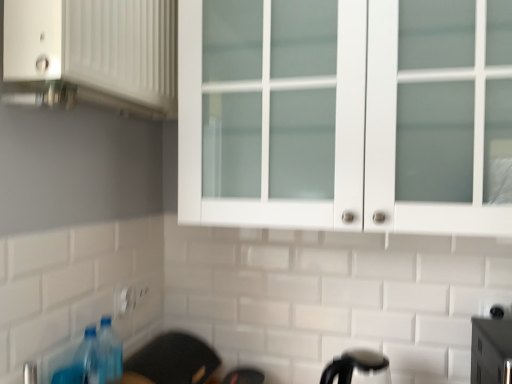
I want to click on white matte cabinet at upper left, so click(x=92, y=54).

This screenshot has height=384, width=512. Identify the location of white glass cabinet at upper center. (346, 114).

What do you see at coordinates (358, 368) in the screenshot?
I see `black plastic kettle at lower center` at bounding box center [358, 368].

Where is `white plastic electric outlet at lower center`? white plastic electric outlet at lower center is located at coordinates (124, 300).

Can you confirm if blue plastic bottle at lower left is positioned to the right of white plastic electric outlet at lower center?

No, blue plastic bottle at lower left is not to the right of white plastic electric outlet at lower center.

From the image's perspective, between blue plastic bottle at lower left and white plastic electric outlet at lower center, which one is located above?

white plastic electric outlet at lower center, from the image's perspective.

Between blue plastic bottle at lower left and white plastic electric outlet at lower center, which one has less height?

Standing shorter between the two is white plastic electric outlet at lower center.

Would you say white glass cabinet at upper center is a long distance from white matte cabinet at upper left?

No.

Is white matte cabinet at upper left a part of white glass cabinet at upper center?

No, white matte cabinet at upper left is not a part of white glass cabinet at upper center.

You are a GUI agent. You are given a task and a screenshot of the screen. Output one action in this format:
    pyautogui.click(x=<x>, y=<y>)
    Task: Click on the cupboard below the white matte cabinet at upper left (from the image's perspective)
    The height and width of the screenshot is (384, 512).
    Given the screenshot: What is the action you would take?
    pyautogui.click(x=346, y=114)

Is white glass cabinet at upper center positioned in front of white matte cabinet at upper left?

No, it is not.

From the image's perspective, which one is positioned lower, white matte cabinet at upper left or white glass cabinet at upper center?

white glass cabinet at upper center appears lower in the image.

Is white matte cabinet at upper left outside of white glass cabinet at upper center?

Absolutely, white matte cabinet at upper left is external to white glass cabinet at upper center.

Is white matte cabinet at upper left looking in the opposite direction of white glass cabinet at upper center?

No.

How distant is white matte cabinet at upper left from white glass cabinet at upper center?

They are 14.47 inches apart.

Between white matte cabinet at upper left and blue plastic bottle at lower left, which one has larger width?

With larger width is white matte cabinet at upper left.

From a real-world perspective, does white matte cabinet at upper left stand above blue plastic bottle at lower left?

Yes.

Which is nearer, (x=134, y=110) or (x=110, y=349)?

Point (x=134, y=110) appears to be farther away from the viewer than point (x=110, y=349).

Is white matte cabinet at upper left inside or outside of blue plastic bottle at lower left?

white matte cabinet at upper left is outside blue plastic bottle at lower left.

Identify the location of electric outlet that appears on the right of blue plastic bottle at lower left. (124, 300).

Is white plastic electric outlet at lower center far from blue plastic bottle at lower left?

Actually, white plastic electric outlet at lower center and blue plastic bottle at lower left are a little close together.

Is white plastic electric outlet at lower center surrounding blue plastic bottle at lower left?

No, white plastic electric outlet at lower center does not contain blue plastic bottle at lower left.

Which of these two, white plastic electric outlet at lower center or blue plastic bottle at lower left, is bigger?

With larger size is blue plastic bottle at lower left.

Consider the image. Are white plastic electric outlet at lower center and white matte cabinet at upper left located far from each other?

No, white plastic electric outlet at lower center is in close proximity to white matte cabinet at upper left.

Considering the positions of point (125, 295) and point (84, 42), is point (125, 295) closer or farther from the camera than point (84, 42)?

Clearly, point (125, 295) is more distant from the camera than point (84, 42).

Is white plastic electric outlet at lower center closer to the viewer compared to white matte cabinet at upper left?

No.

From the image's perspective, is white plastic electric outlet at lower center on white matte cabinet at upper left?

Actually, white plastic electric outlet at lower center appears below white matte cabinet at upper left in the image.

Could you measure the distance between white plastic electric outlet at lower center and white glass cabinet at upper center?

white plastic electric outlet at lower center is 32.67 inches away from white glass cabinet at upper center.

Can we say white plastic electric outlet at lower center lies outside white glass cabinet at upper center?

Yes, white plastic electric outlet at lower center is outside of white glass cabinet at upper center.

From a real-world perspective, is white plastic electric outlet at lower center located higher than white glass cabinet at upper center?

No, from a real-world perspective, white plastic electric outlet at lower center is not above white glass cabinet at upper center.

Is white plastic electric outlet at lower center far from white glass cabinet at upper center?

No.

This screenshot has width=512, height=384. Identify the location of bottle to the left of white plastic electric outlet at lower center. (111, 350).

Where is `cupboard below the white matte cabinet at upper left (from the image's perspective)`? cupboard below the white matte cabinet at upper left (from the image's perspective) is located at coordinates (346, 114).

Estimate the real-world distances between objects in this image. Which object is further from white glass cabinet at upper center, white matte cabinet at upper left or black plastic kettle at lower center?

Among the two, black plastic kettle at lower center is located further to white glass cabinet at upper center.

From the image, which object appears to be nearer to blue plastic bottle at lower left, white plastic electric outlet at lower center or black plastic kettle at lower center?

The object closer to blue plastic bottle at lower left is white plastic electric outlet at lower center.

Consider the image. Looking at the image, which one is located closer to blue plastic bottle at lower left, white matte cabinet at upper left or black plastic kettle at lower center?

black plastic kettle at lower center is closer to blue plastic bottle at lower left.

Based on their spatial positions, is white plastic electric outlet at lower center or blue plastic bottle at lower left further from black plastic kettle at lower center?

white plastic electric outlet at lower center.

Which object lies further to the anchor point white matte cabinet at upper left, white glass cabinet at upper center or black plastic kettle at lower center?

Among the two, black plastic kettle at lower center is located further to white matte cabinet at upper left.

Looking at the image, which one is located closer to white plastic electric outlet at lower center, blue plastic bottle at lower left or white matte cabinet at upper left?

blue plastic bottle at lower left lies closer to white plastic electric outlet at lower center than the other object.

Considering their positions, is black plastic kettle at lower center positioned further to white plastic electric outlet at lower center than white matte cabinet at upper left?

Based on the image, black plastic kettle at lower center appears to be further to white plastic electric outlet at lower center.

Which object lies further to the anchor point white glass cabinet at upper center, black plastic kettle at lower center or white matte cabinet at upper left?

black plastic kettle at lower center lies further to white glass cabinet at upper center than the other object.

Locate an element on the screen. This screenshot has height=384, width=512. bottle between white matte cabinet at upper left and black plastic kettle at lower center in the up-down direction is located at coordinates (111, 350).

Where is `bottle that lies between white glass cabinet at upper center and black plastic kettle at lower center from top to bottom`? bottle that lies between white glass cabinet at upper center and black plastic kettle at lower center from top to bottom is located at coordinates [x=111, y=350].

Where is `cupboard between white matte cabinet at upper left and black plastic kettle at lower center in the up-down direction`? cupboard between white matte cabinet at upper left and black plastic kettle at lower center in the up-down direction is located at coordinates (346, 114).

Where is `cupboard between white matte cabinet at upper left and blue plastic bottle at lower left vertically`? cupboard between white matte cabinet at upper left and blue plastic bottle at lower left vertically is located at coordinates (346, 114).